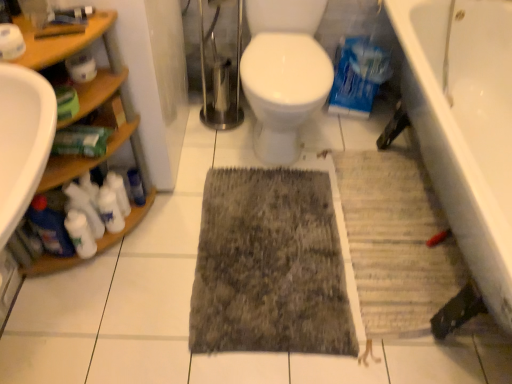
Image resolution: width=512 pixels, height=384 pixels. What are the coordinates of `free space that is in between white matte cleaning product at lower left, the 3th cleaning product viewed from the right, and dark gray textured rug at center` in the screenshot? It's located at (162, 252).